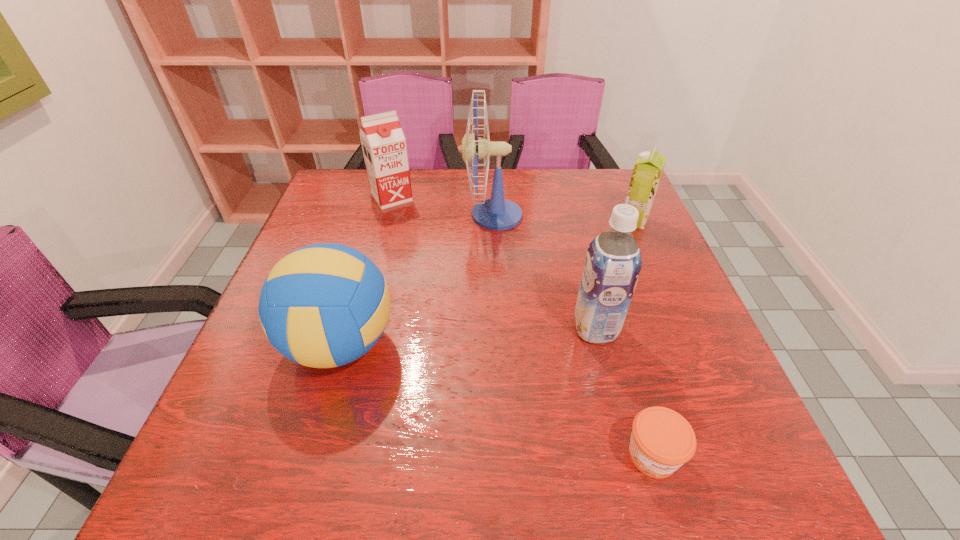
At what (x,y) coordinates should I click in order to perform the action: click on vacant area situated at the front of the fan where the blades are visible. Please return your answer as a coordinate pair (x, y). Image resolution: width=960 pixels, height=540 pixels. Looking at the image, I should click on [x=360, y=215].

This screenshot has width=960, height=540. I want to click on free space located 0.260m at the front of the fan where the blades are visible, so click(x=371, y=215).

Locate an element on the screen. vacant space located at the front of the fan where the blades are visible is located at coordinates click(x=371, y=215).

I want to click on vacant space located 0.120m on the label of the tallest soya milk, so click(x=517, y=328).

Locate an element on the screen. The width and height of the screenshot is (960, 540). vacant space located 0.400m on the label of the tallest soya milk is located at coordinates (383, 328).

Where is `free space located 0.330m on the label of the tallest soya milk`? This screenshot has width=960, height=540. free space located 0.330m on the label of the tallest soya milk is located at coordinates (417, 328).

You are a GUI agent. You are given a task and a screenshot of the screen. Output one action in this format:
    pyautogui.click(x=<x>, y=<y>)
    Task: Click on the vacant space located on the right of the farthest soya milk
    This screenshot has height=540, width=960.
    Given the screenshot: What is the action you would take?
    pyautogui.click(x=441, y=198)

Find the location of a particular element. free region located on the front of the volleyball is located at coordinates (312, 440).

Where is `free space located 0.220m on the left of the rightmost soya milk`? free space located 0.220m on the left of the rightmost soya milk is located at coordinates (539, 220).

You are a GUI agent. You are given a task and a screenshot of the screen. Output one action in this format:
    pyautogui.click(x=<x>, y=<y>)
    Task: Click on the fan that is at the far edge
    
    Given the screenshot: What is the action you would take?
    point(497,213)